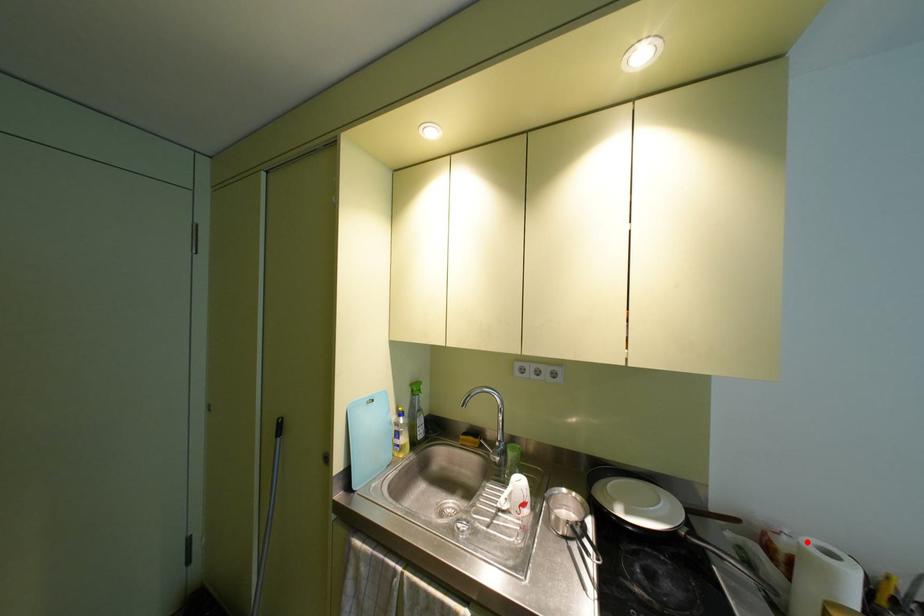
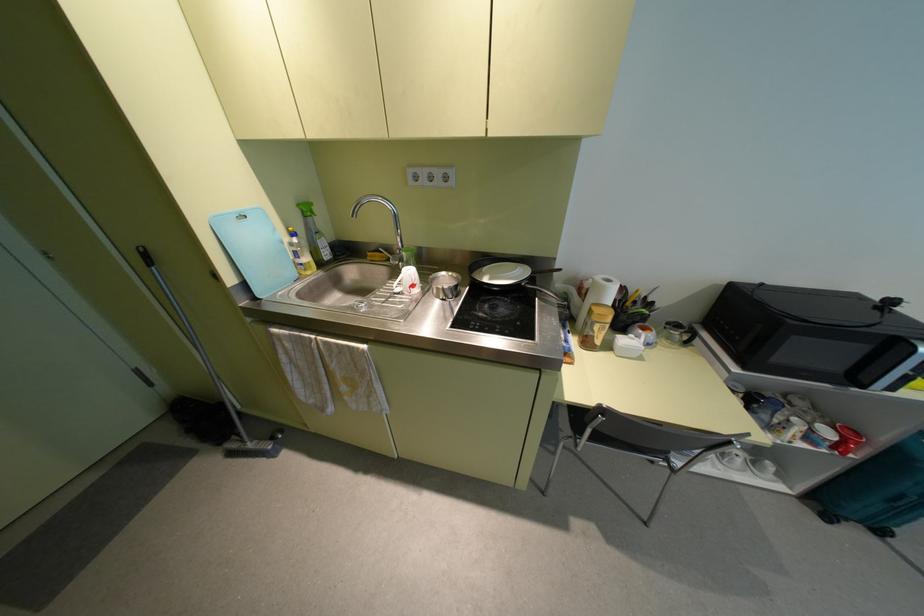
The point at the highlighted location is marked in the first image. Where is the corresponding point in the second image?

(599, 277)